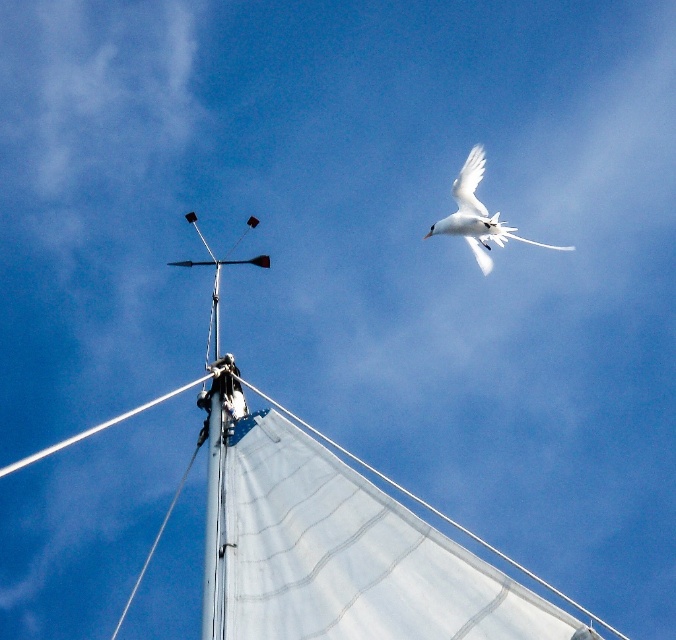
Can you confirm if white fabric sailboat at upper center is positioned above white feathered bird at upper right?

No.

Looking at this image, does white fabric sailboat at upper center come behind white feathered bird at upper right?

No.

Where is `white fabric sailboat at upper center`? This screenshot has height=640, width=676. white fabric sailboat at upper center is located at coordinates (327, 532).